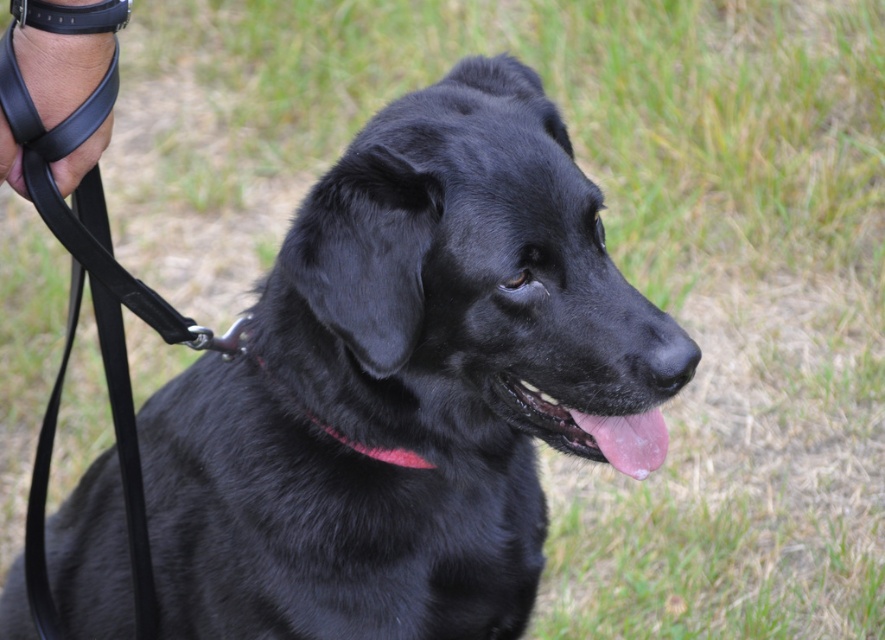
Is pink glossy tongue at center thinner than pink fabric neckband at center?

Correct, pink glossy tongue at center's width is less than pink fabric neckband at center's.

What are the coordinates of `pink glossy tongue at center` in the screenshot? It's located at (601, 429).

This screenshot has width=885, height=640. In order to click on pink glossy tongue at center in this screenshot , I will do pos(601,429).

Based on the photo, who is shorter, black matte dog at center or black leather leash at upper left?

Standing shorter between the two is black leather leash at upper left.

What do you see at coordinates (402, 385) in the screenshot? This screenshot has width=885, height=640. I see `black matte dog at center` at bounding box center [402, 385].

Which is in front, point (225, 598) or point (48, 132)?

Point (48, 132)

Identify the location of black matte dog at center. (402, 385).

Who is taller, black leather leash at upper left or pink fabric neckband at center?

Standing taller between the two is black leather leash at upper left.

Does black leather leash at upper left have a lesser width compared to pink fabric neckband at center?

Indeed, black leather leash at upper left has a lesser width compared to pink fabric neckband at center.

Does point (96, 49) come in front of point (376, 451)?

Yes.

At what (x,y) coordinates should I click in order to perform the action: click on black leather leash at upper left. Please return your answer as a coordinate pair (x, y). The height and width of the screenshot is (640, 885). Looking at the image, I should click on tap(63, 52).